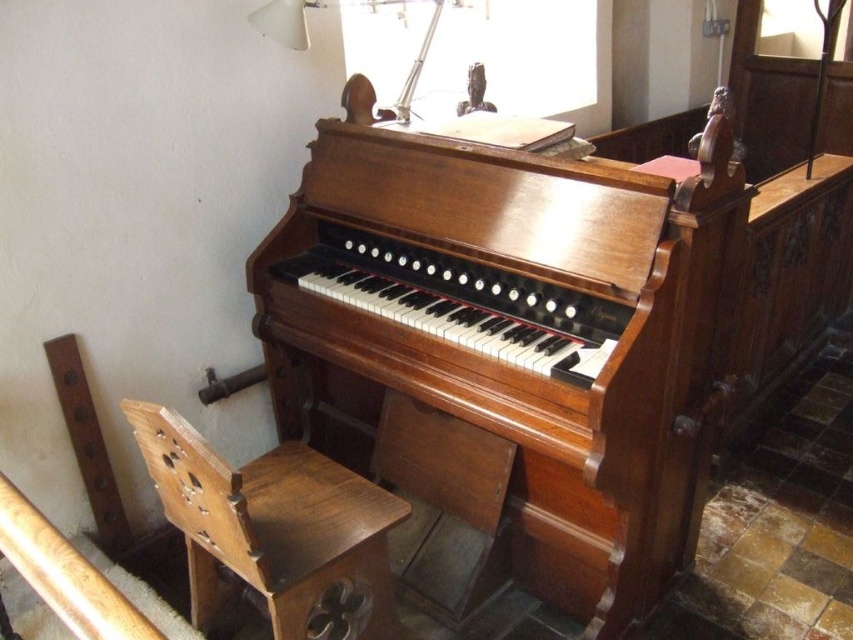
Question: Which point appears farthest from the camera in this image?

Choices:
 (A) (550, 544)
 (B) (271, 556)
 (C) (282, 13)

Answer: (C)

Question: Considering the relative positions of shiny brown piano at center and brown wooden chair at lower left in the image provided, where is shiny brown piano at center located with respect to brown wooden chair at lower left?

Choices:
 (A) right
 (B) left

Answer: (A)

Question: In this image, where is brown wooden chair at lower left located relative to white plastic lamp at upper center?

Choices:
 (A) left
 (B) right

Answer: (A)

Question: Can you confirm if shiny brown piano at center is smaller than white plastic lamp at upper center?

Choices:
 (A) no
 (B) yes

Answer: (A)

Question: Which point is closer to the camera?

Choices:
 (A) white plastic lamp at upper center
 (B) shiny brown piano at center

Answer: (B)

Question: Which point is farther to the camera?

Choices:
 (A) white plastic lamp at upper center
 (B) brown wooden chair at lower left
 (C) shiny brown piano at center

Answer: (A)